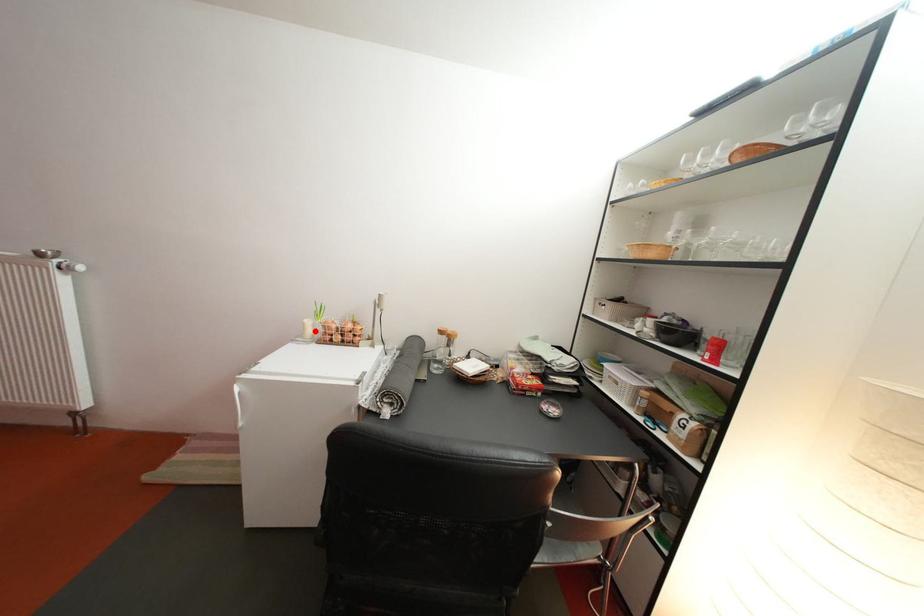
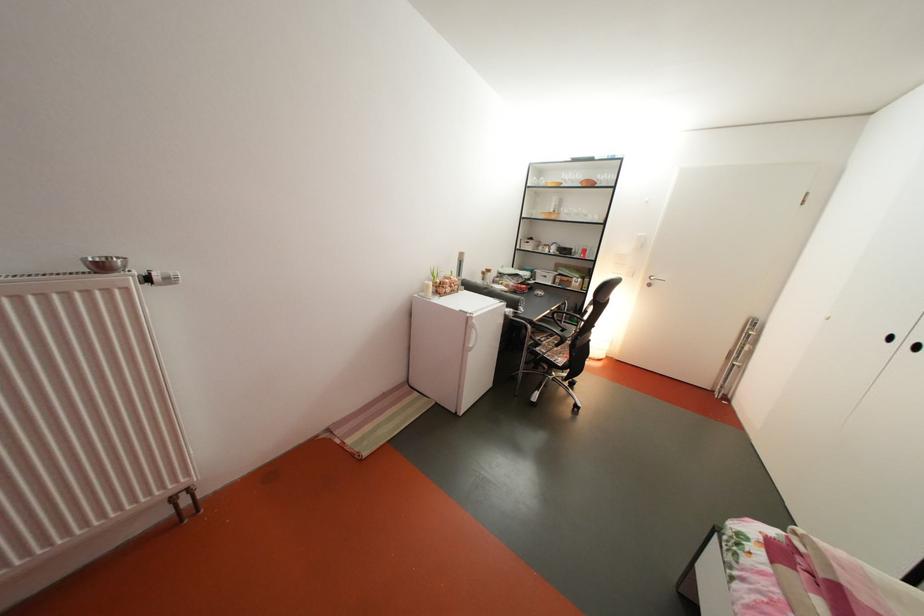
The point at the highlighted location is marked in the first image. Where is the corresponding point in the second image?

(439, 293)